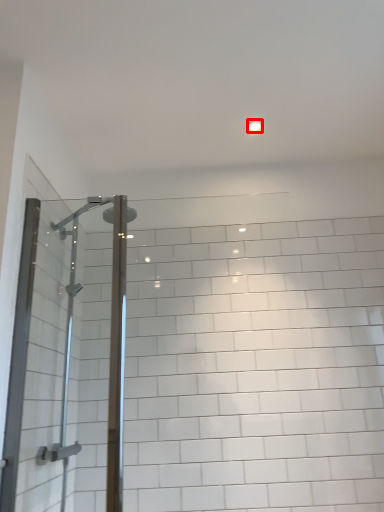
Question: From the image's perspective, where is light fixture (annotated by the red box) located in relation to screen door in the image?

Choices:
 (A) above
 (B) below

Answer: (A)